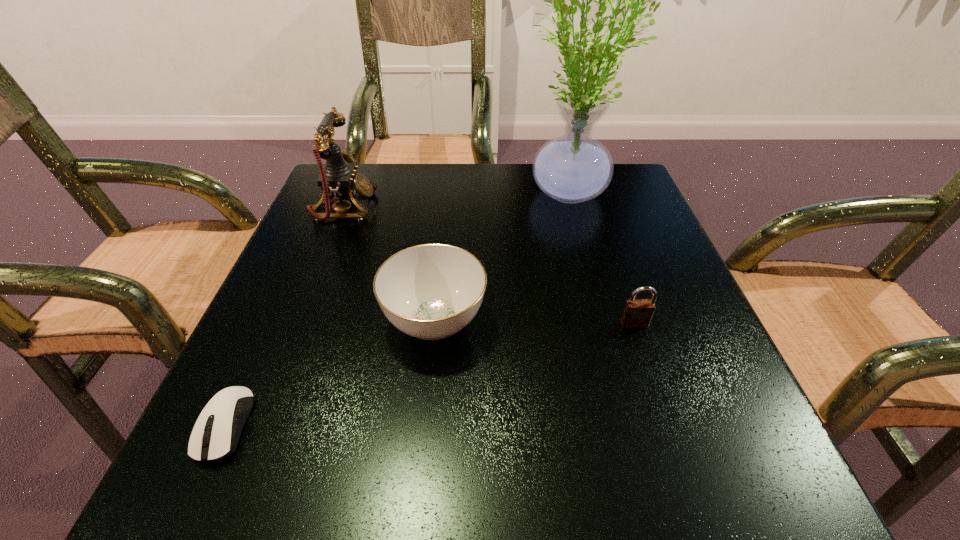
You are a GUI agent. You are given a task and a screenshot of the screen. Output one action in this format:
    pyautogui.click(x=<x>, y=<y>)
    Task: Click on the blank area in the image that satisfies the following two spatial constraints: 1. on the front of the chinaware, featuring the rotary dial; 2. on the right side of the telephone
    This screenshot has height=540, width=960.
    Given the screenshot: What is the action you would take?
    pyautogui.click(x=300, y=321)

Image resolution: width=960 pixels, height=540 pixels. Identify the location of vacant space that satisfies the following two spatial constraints: 1. on the back side of the nearest object; 2. on the left side of the flower arrangement. (331, 194).

Image resolution: width=960 pixels, height=540 pixels. I want to click on free point that satisfies the following two spatial constraints: 1. on the front side of the tallest object; 2. on the front of the fourth shortest object, featuring the rotary dial, so click(569, 208).